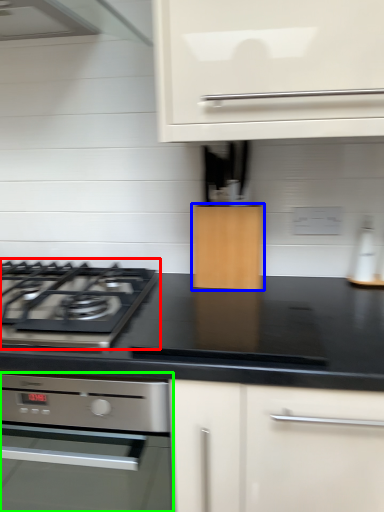
Question: Which object is positioned closest to gas stove (highlighted by a red box)? Select from cabinetry (highlighted by a blue box) and home appliance (highlighted by a green box).

Choices:
 (A) cabinetry
 (B) home appliance

Answer: (A)